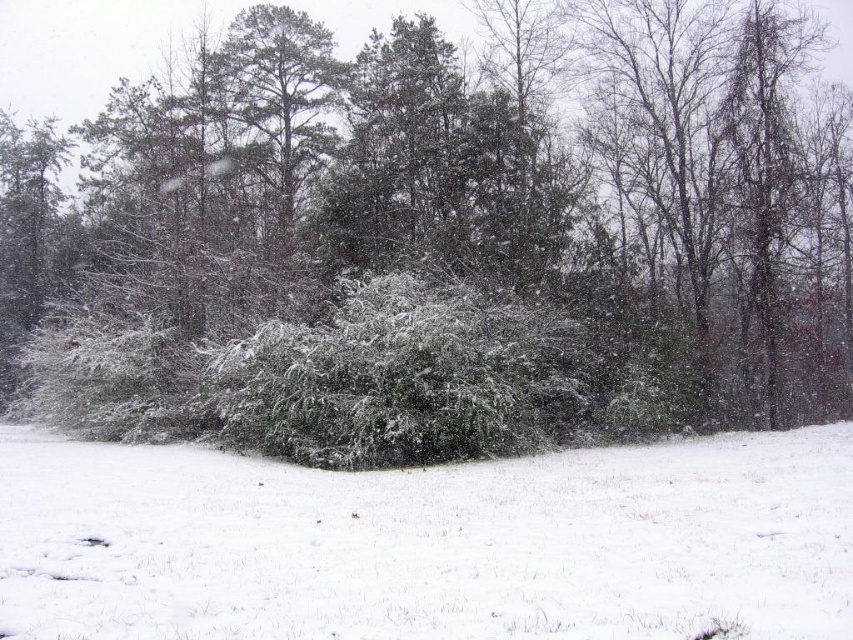
You are an artist trying to paint the snowy landscape. You notice the green matte bush at center and the white fluffy snow at center. Which object should you depict as wider in your painting?

The green matte bush at center should be depicted as wider in the painting since its width surpasses that of the white fluffy snow at center according to the description.